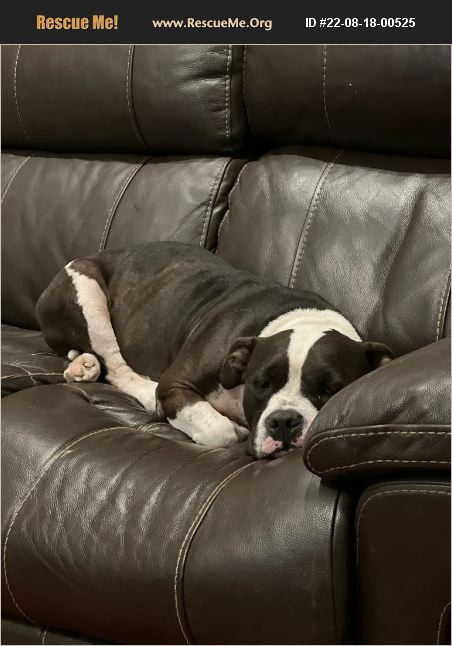
Locate an element on the screen. The height and width of the screenshot is (646, 452). lower body rest on couch is located at coordinates 146,205, 279,207.